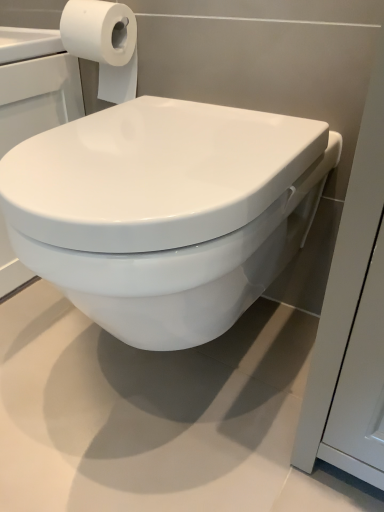
The image size is (384, 512). Describe the element at coordinates (166, 212) in the screenshot. I see `white glossy toilet at center` at that location.

In order to click on white glossy toilet at center in this screenshot , I will do `click(166, 212)`.

What is the approximate width of white glossy toilet at center?

20.89 inches.

This screenshot has width=384, height=512. In order to click on white matte toilet paper at upper left in this screenshot , I will do `click(104, 44)`.

What is the approximate width of white matte toilet paper at upper left?

5.00 inches.

Describe the element at coordinates (104, 44) in the screenshot. I see `white matte toilet paper at upper left` at that location.

Where is `white glossy toilet at center`? Image resolution: width=384 pixels, height=512 pixels. white glossy toilet at center is located at coordinates (166, 212).

Considering the positions of objects white matte toilet paper at upper left and white glossy toilet at center in the image provided, who is more to the left, white matte toilet paper at upper left or white glossy toilet at center?

From the viewer's perspective, white matte toilet paper at upper left appears more on the left side.

Based on the photo, does white matte toilet paper at upper left lie behind white glossy toilet at center?

Yes.

Which is nearer, (93, 30) or (234, 288)?

Point (93, 30) is farther from the camera than point (234, 288).

From the image's perspective, who appears lower, white matte toilet paper at upper left or white glossy toilet at center?

white glossy toilet at center appears lower in the image.

From a real-world perspective, which is physically below, white matte toilet paper at upper left or white glossy toilet at center?

white glossy toilet at center is physically lower.

Is white matte toilet paper at upper left wider than white glossy toilet at center?

In fact, white matte toilet paper at upper left might be narrower than white glossy toilet at center.

Looking at this image, considering the sizes of objects white matte toilet paper at upper left and white glossy toilet at center in the image provided, who is taller, white matte toilet paper at upper left or white glossy toilet at center?

Standing taller between the two is white glossy toilet at center.

Who is smaller, white matte toilet paper at upper left or white glossy toilet at center?

With smaller size is white matte toilet paper at upper left.

Is white matte toilet paper at upper left inside the boundaries of white glossy toilet at center, or outside?

white matte toilet paper at upper left cannot be found inside white glossy toilet at center.

Are white matte toilet paper at upper left and white glossy toilet at center beside each other?

No, white matte toilet paper at upper left is not with white glossy toilet at center.

Is white matte toilet paper at upper left oriented towards white glossy toilet at center?

No, white matte toilet paper at upper left does not turn towards white glossy toilet at center.

Based on the photo, can you tell me how much white matte toilet paper at upper left and white glossy toilet at center differ in facing direction?

They differ by 0.105 degrees in their facing directions.

How far apart are white matte toilet paper at upper left and white glossy toilet at center?

white matte toilet paper at upper left is 16.22 inches from white glossy toilet at center.

Locate an element on the screen. toilet below the white matte toilet paper at upper left (from the image's perspective) is located at coordinates (166, 212).

Would you say white glossy toilet at center is to the left or to the right of white matte toilet paper at upper left in the picture?

Clearly, white glossy toilet at center is on the right of white matte toilet paper at upper left in the image.

Does white glossy toilet at center come behind white matte toilet paper at upper left?

No, the depth of white glossy toilet at center is less than that of white matte toilet paper at upper left.

Is point (91, 115) closer or farther from the camera than point (72, 46)?

Clearly, point (91, 115) is closer to the camera than point (72, 46).

Consider the image. From the image's perspective, is white glossy toilet at center positioned above or below white matte toilet paper at upper left?

Based on their image positions, white glossy toilet at center is located beneath white matte toilet paper at upper left.

From a real-world perspective, relative to white matte toilet paper at upper left, is white glossy toilet at center vertically above or below?

white glossy toilet at center is situated lower than white matte toilet paper at upper left in the real world.

Is white glossy toilet at center wider or thinner than white matte toilet paper at upper left?

In the image, white glossy toilet at center appears to be wider than white matte toilet paper at upper left.

Is white glossy toilet at center taller than white matte toilet paper at upper left?

Yes.

Who is bigger, white glossy toilet at center or white matte toilet paper at upper left?

white glossy toilet at center is bigger.

Is white glossy toilet at center positioned beyond the bounds of white matte toilet paper at upper left?

Yes, white glossy toilet at center is not within white matte toilet paper at upper left.

Is there a large distance between white glossy toilet at center and white matte toilet paper at upper left?

No.

Is white glossy toilet at center positioned with its back to white matte toilet paper at upper left?

No.

How many degrees apart are the facing directions of white glossy toilet at center and white matte toilet paper at upper left?

0.105 degrees.

How distant is white glossy toilet at center from white matte toilet paper at upper left?

A distance of 16.22 inches exists between white glossy toilet at center and white matte toilet paper at upper left.

Identify the location of toilet on the right of white matte toilet paper at upper left. Image resolution: width=384 pixels, height=512 pixels. (166, 212).

Where is `toilet paper lying above the white glossy toilet at center (from the image's perspective)`? toilet paper lying above the white glossy toilet at center (from the image's perspective) is located at coordinates (104, 44).

The width and height of the screenshot is (384, 512). I want to click on toilet beneath the white matte toilet paper at upper left (from a real-world perspective), so click(x=166, y=212).